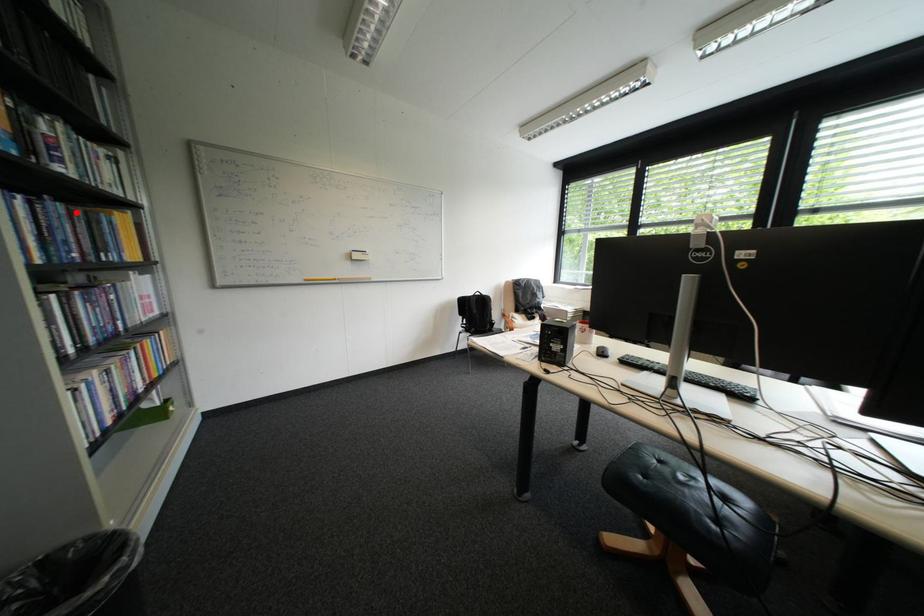
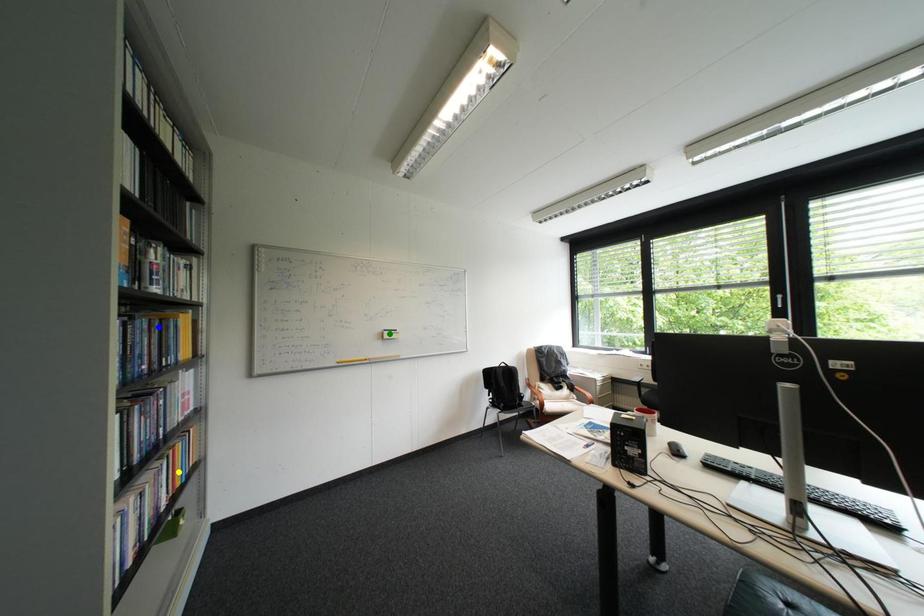
Question: I am providing you with two images of the same scene from different viewpoints. A red point is marked on the first image. You are given multiple points on the second image. Which point in image 2 is actually the same real-world point as the red point in image 1?

Choices:
 (A) green point
 (B) yellow point
 (C) blue point

Answer: (C)